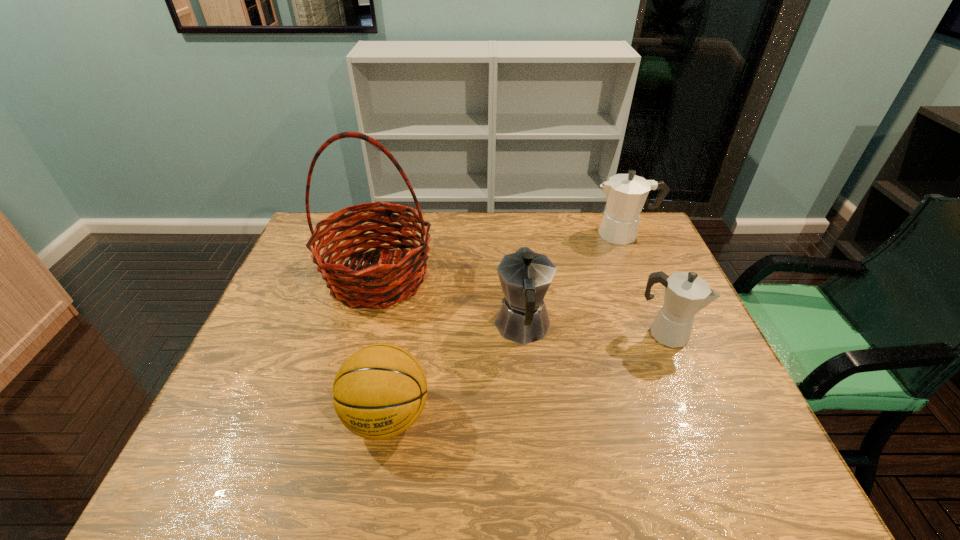
Locate an element on the screen. The height and width of the screenshot is (540, 960). vacant space situated at the spout of the third object from right to left is located at coordinates (514, 234).

The height and width of the screenshot is (540, 960). In order to click on basket present at the far edge in this screenshot , I will do `click(397, 280)`.

This screenshot has height=540, width=960. What are the coordinates of `coffeepot that is at the far edge` in the screenshot? It's located at (626, 194).

This screenshot has width=960, height=540. Identify the location of object positioned at the near edge. (379, 392).

This screenshot has width=960, height=540. I want to click on object located in the left edge section of the desktop, so pyautogui.click(x=397, y=280).

This screenshot has height=540, width=960. I want to click on object located at the far left corner, so click(x=397, y=280).

Identify the location of object located at the far right corner. This screenshot has width=960, height=540. 626,194.

The height and width of the screenshot is (540, 960). What are the coordinates of `free location at the far edge` in the screenshot? It's located at (547, 214).

I want to click on vacant space at the near edge of the desktop, so click(x=511, y=452).

At what (x,y) coordinates should I click in order to perform the action: click on vacant space at the left edge of the desktop. Please return your answer as a coordinate pair (x, y). Image resolution: width=960 pixels, height=540 pixels. Looking at the image, I should click on (292, 375).